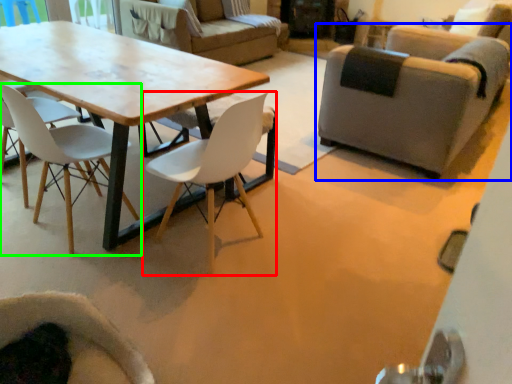
Question: Based on their relative distances, which object is farther from chair (highlighted by a red box)? Choose from chair (highlighted by a blue box) and chair (highlighted by a green box).

Choices:
 (A) chair
 (B) chair

Answer: (A)